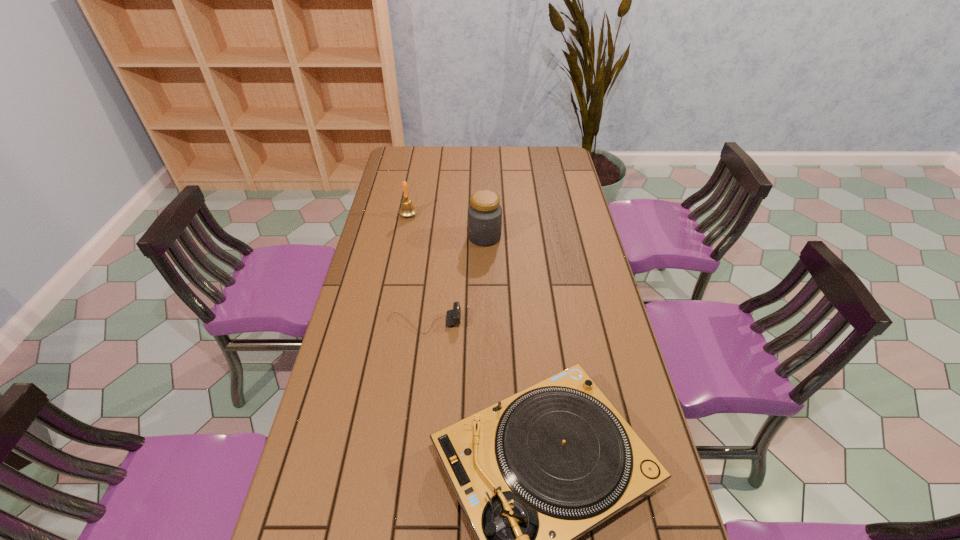
The image size is (960, 540). Identify the location of webcam at the left edge. (453, 316).

Locate an element on the screen. This screenshot has width=960, height=540. vacant space at the far edge of the desktop is located at coordinates (507, 152).

Where is `vacant region at the left edge of the desktop`? vacant region at the left edge of the desktop is located at coordinates (341, 385).

Where is `vacant space at the right edge`? The width and height of the screenshot is (960, 540). vacant space at the right edge is located at coordinates pyautogui.click(x=557, y=223).

Locate an element on the screen. The image size is (960, 540). free spot at the far left corner of the desktop is located at coordinates (396, 154).

Where is `vacant space at the far right corner`? This screenshot has width=960, height=540. vacant space at the far right corner is located at coordinates (534, 153).

At what (x,y) coordinates should I click in order to perform the action: click on empty location between the webcam and the third nearest object. Please return your answer as a coordinate pair (x, y). Looking at the image, I should click on (454, 280).

At what (x,y) coordinates should I click in order to perform the action: click on free point between the webcam and the farthest object. Please return your answer as a coordinate pair (x, y). This screenshot has width=960, height=540. Looking at the image, I should click on (417, 269).

In order to click on empty location between the farthest object and the shortest object in this screenshot , I will do `click(417, 269)`.

This screenshot has height=540, width=960. I want to click on free space between the second nearest object and the farthest object, so click(417, 269).